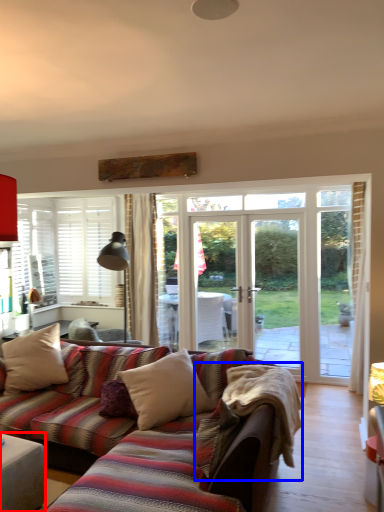
Question: Which object appears farthest to the camera in this image, table (highlighted by a red box) or blanket (highlighted by a blue box)?

Choices:
 (A) table
 (B) blanket

Answer: (B)